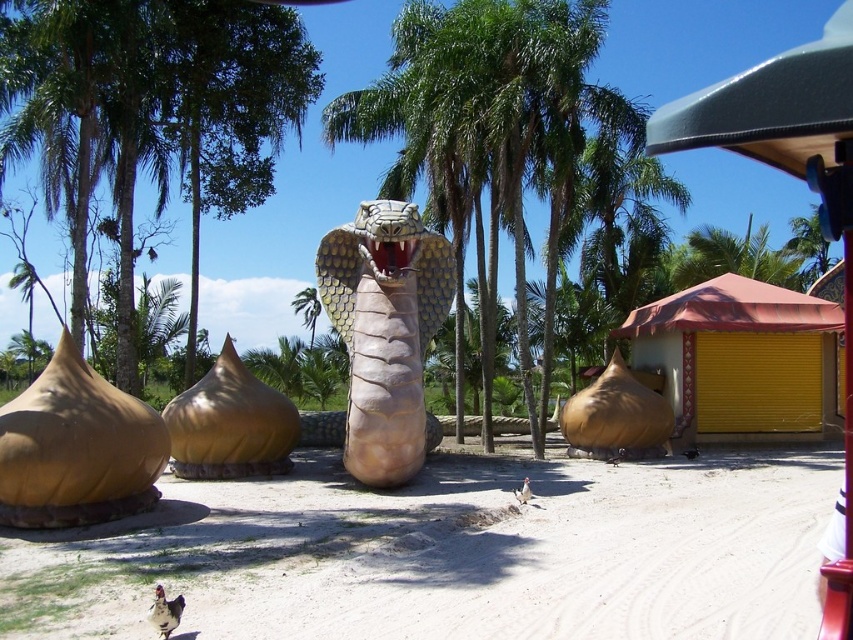
Question: Observing the image, what is the correct spatial positioning of matte gold snake at center in reference to matte gold dome at left?

Choices:
 (A) right
 (B) left

Answer: (A)

Question: Among these objects, which one is farthest from the camera?

Choices:
 (A) matte gold dome at center
 (B) matte gold snake at center

Answer: (A)

Question: Is green leafy palm tree at center positioned before matte gold dome at left?

Choices:
 (A) yes
 (B) no

Answer: (B)

Question: Which object is the farthest from the white sandy ground at center?

Choices:
 (A) brown matte gourd at center
 (B) matte gold snake at center
 (C) matte gold dome at center
 (D) green leafy palm tree at center

Answer: (D)

Question: Does white sandy ground at center appear under green leafy palm tree at center?

Choices:
 (A) no
 (B) yes

Answer: (B)

Question: Which point is farther to the camera?

Choices:
 (A) matte gold snake at center
 (B) brown matte gourd at center
 (C) white sandy ground at center

Answer: (B)